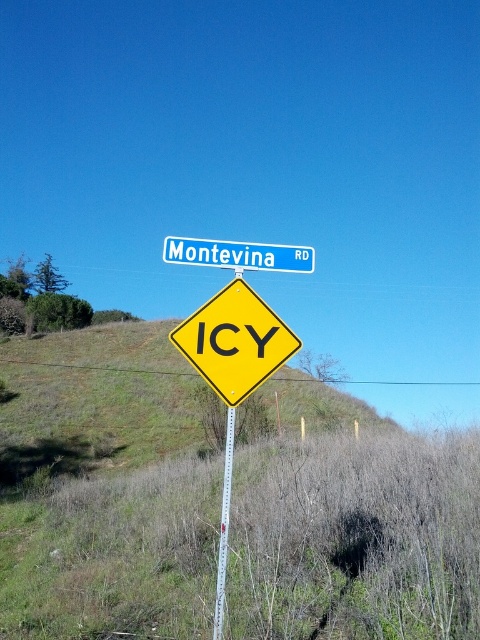
Question: Does yellow diamond-shaped warning sign at center have a smaller size compared to blue metallic street sign at upper center?

Choices:
 (A) yes
 (B) no

Answer: (A)

Question: Does yellow diamond-shaped warning sign at center come behind metallic silver pole at center?

Choices:
 (A) no
 (B) yes

Answer: (B)

Question: Can you confirm if blue metallic street sign at upper center is bigger than metallic silver pole at center?

Choices:
 (A) yes
 (B) no

Answer: (A)

Question: Which point is farther from the camera taking this photo?

Choices:
 (A) (244, 284)
 (B) (290, 636)

Answer: (B)

Question: Based on their relative distances, which object is nearer to the metallic silver pole at center?

Choices:
 (A) blue metallic street sign at upper center
 (B) dry grass at center
 (C) yellow diamond-shaped warning sign at center

Answer: (C)

Question: Which point is closer to the camera?

Choices:
 (A) blue metallic street sign at upper center
 (B) metallic silver pole at center
 (C) yellow diamond-shaped warning sign at center

Answer: (B)